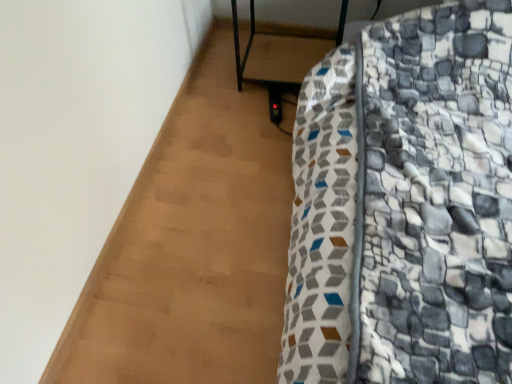
Where is `free location to the left of metallic black side table at center, the 1th furniture from the top`? Image resolution: width=512 pixels, height=384 pixels. free location to the left of metallic black side table at center, the 1th furniture from the top is located at coordinates (215, 78).